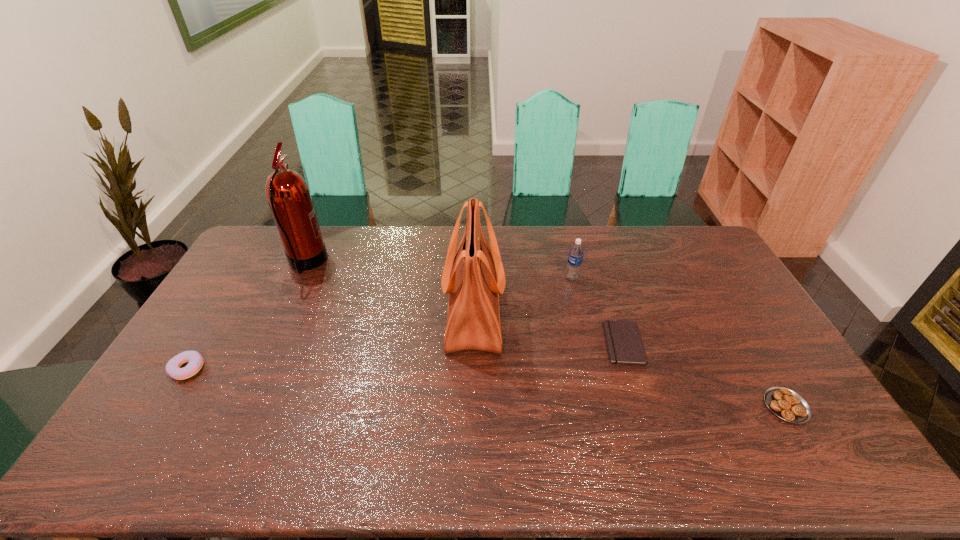
Where is `the tallest object`? the tallest object is located at coordinates (288, 195).

I want to click on the second object from left to right, so click(288, 195).

This screenshot has height=540, width=960. Find the location of `the second tallest object`. the second tallest object is located at coordinates (474, 277).

Identify the location of shopping bag. (474, 277).

Identify the location of water bottle. This screenshot has height=540, width=960. (576, 252).

Identify the location of the fourth object from left to right. (576, 252).

Locate an element on the screen. This screenshot has height=540, width=960. the leftmost object is located at coordinates (195, 360).

Identify the location of the rightmost object. (786, 404).

The image size is (960, 540). Find the location of `the nearest object`. the nearest object is located at coordinates (786, 404).

Where is `the shortest object`? the shortest object is located at coordinates (623, 339).